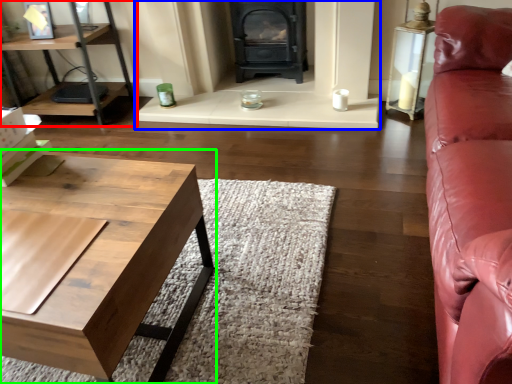
Question: Based on their relative distances, which object is farther from shelf (highlighted by a red box)? Choose from fireplace (highlighted by a blue box) and coffee table (highlighted by a green box).

Choices:
 (A) fireplace
 (B) coffee table

Answer: (B)